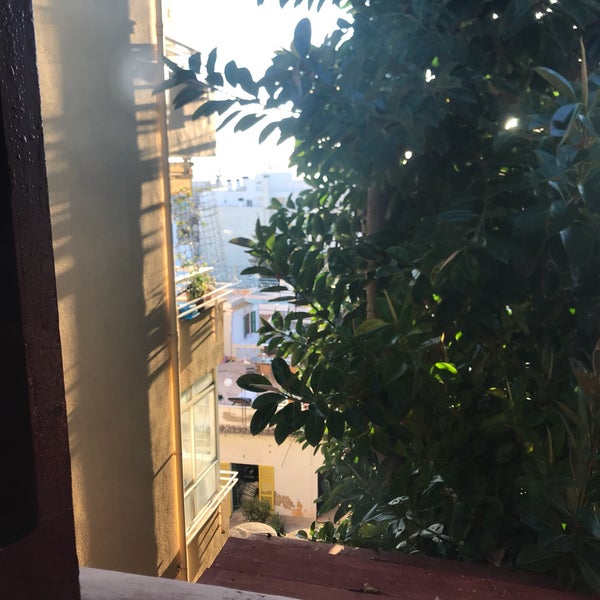
Where is `yellow shutters`? The image size is (600, 600). yellow shutters is located at coordinates (266, 477), (223, 467).